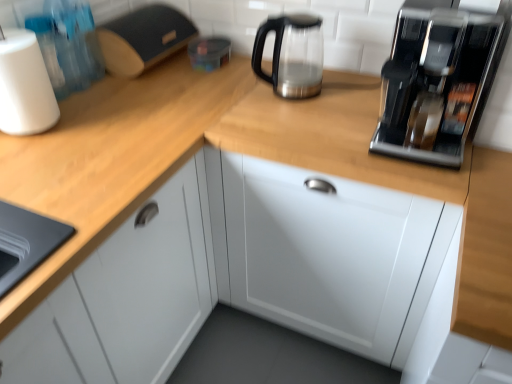
Identify the location of spots to the right of white matte paper towel at left. (88, 117).